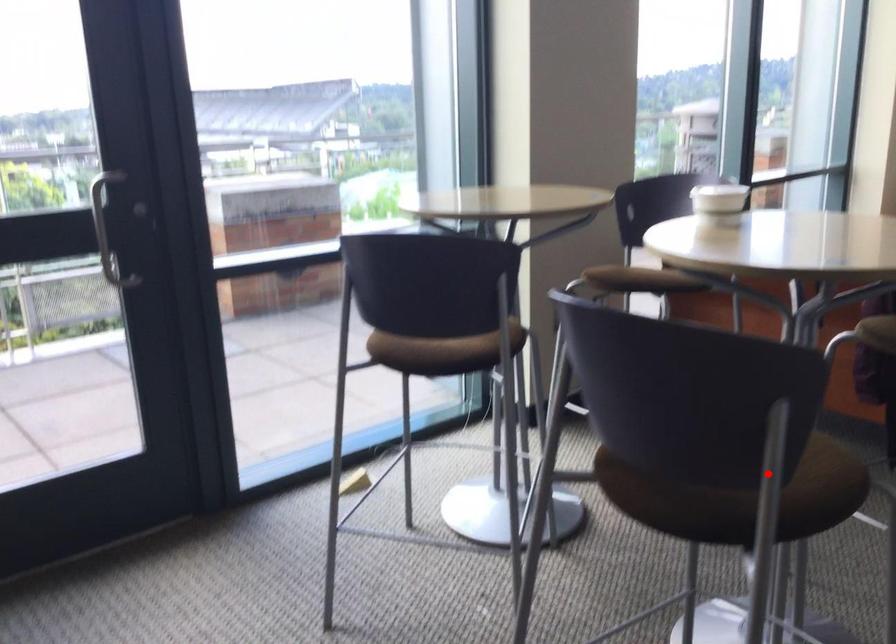
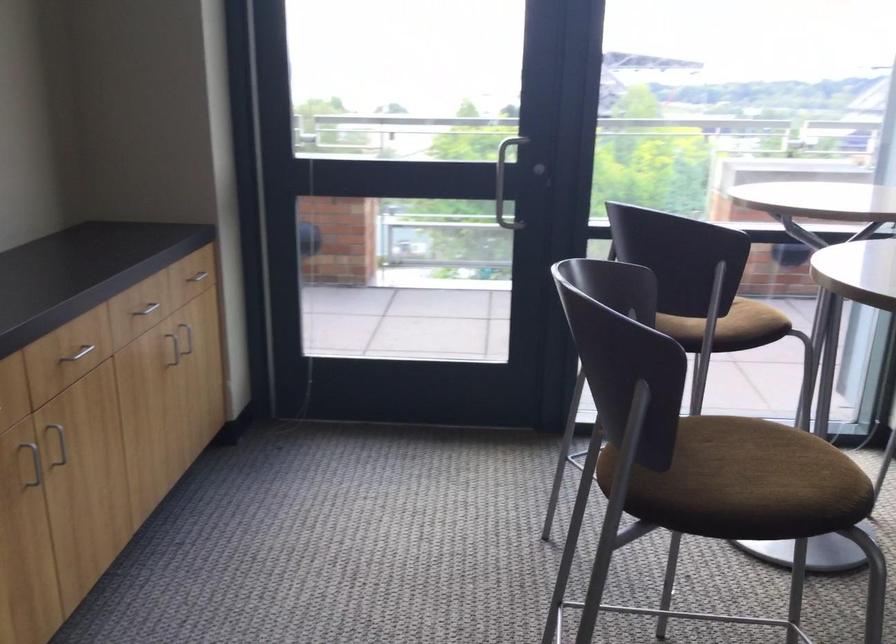
Question: I am providing you with two images of the same scene from different viewpoints. Given a red point in image1, look at the same physical point in image2. Is it:

Choices:
 (A) Closer to the viewpoint
 (B) Farther from the viewpoint

Answer: (B)